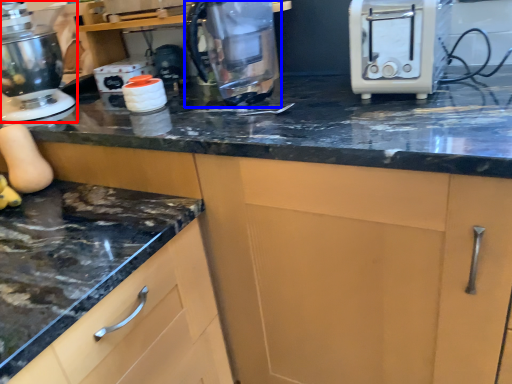
Question: Which of the following is the farthest to the observer, home appliance (highlighted by a red box) or kitchen appliance (highlighted by a blue box)?

Choices:
 (A) home appliance
 (B) kitchen appliance

Answer: (A)